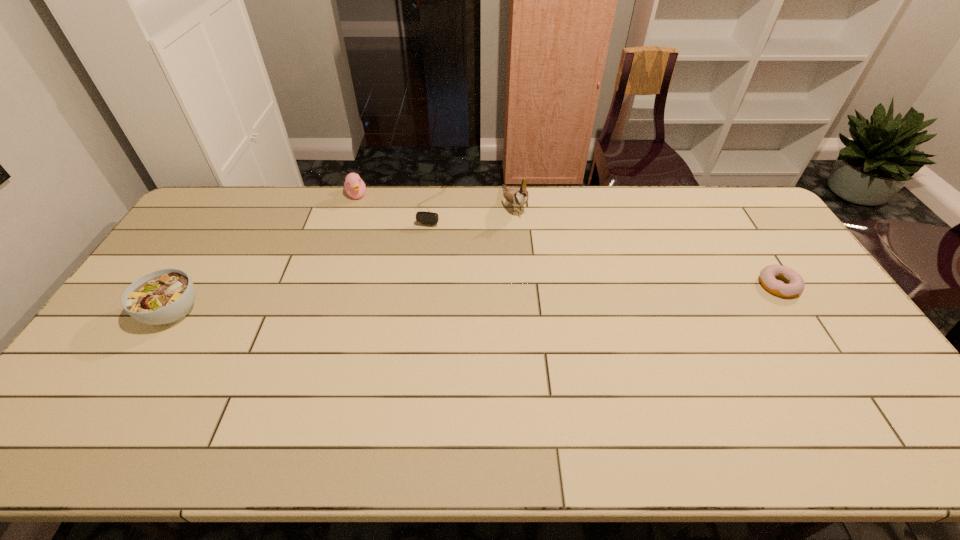
Where is `duckling at the far edge`? This screenshot has height=540, width=960. duckling at the far edge is located at coordinates (355, 187).

The image size is (960, 540). Identify the location of bird located at the far edge. (518, 197).

I want to click on object at the left edge, so click(x=165, y=296).

This screenshot has height=540, width=960. What are the coordinates of `object located in the right edge section of the desktop` in the screenshot? It's located at pyautogui.click(x=768, y=275).

The image size is (960, 540). In the image, there is a desktop. What are the coordinates of `blank space at the far edge` in the screenshot? It's located at 490,188.

Where is `vacant area at the near edge of the desktop`? The width and height of the screenshot is (960, 540). vacant area at the near edge of the desktop is located at coordinates (280, 388).

The image size is (960, 540). In order to click on free space at the right edge of the desktop in this screenshot , I will do `click(775, 252)`.

This screenshot has height=540, width=960. I want to click on free region at the near left corner of the desktop, so click(x=129, y=386).

In the image, there is a desktop. Where is `free region at the far right corner`? Image resolution: width=960 pixels, height=540 pixels. free region at the far right corner is located at coordinates (742, 189).

The image size is (960, 540). Identify the location of vacant area that lies between the webcam and the duckling. (394, 201).